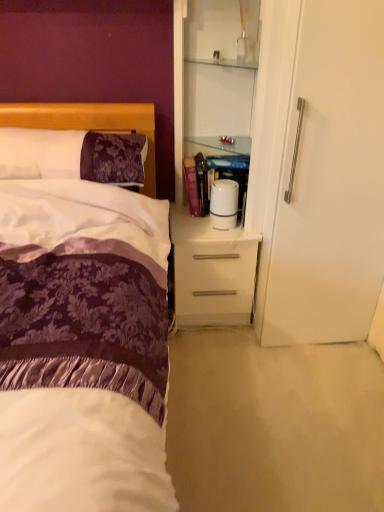
Question: Should I look upward or downward to see purple damask pillow at left?

Choices:
 (A) up
 (B) down

Answer: (A)

Question: Does purple damask pillow at left have a greater width compared to white glossy cabinet at upper right?

Choices:
 (A) yes
 (B) no

Answer: (A)

Question: From a real-world perspective, is purple damask pillow at left on white glossy cabinet at upper right?

Choices:
 (A) yes
 (B) no

Answer: (B)

Question: Is purple damask pillow at left positioned behind white glossy cabinet at upper right?

Choices:
 (A) yes
 (B) no

Answer: (A)

Question: Does purple damask pillow at left have a greater height compared to white glossy cabinet at upper right?

Choices:
 (A) no
 (B) yes

Answer: (A)

Question: From the image's perspective, is purple damask pillow at left on top of white glossy cabinet at upper right?

Choices:
 (A) no
 (B) yes

Answer: (A)

Question: Is purple damask pillow at left located outside white glossy cabinet at upper right?

Choices:
 (A) no
 (B) yes

Answer: (B)

Question: Can you confirm if white glossy nightstand at center is thinner than purple damask pillow at left?

Choices:
 (A) no
 (B) yes

Answer: (A)

Question: Is the depth of white glossy nightstand at center less than that of purple damask pillow at left?

Choices:
 (A) no
 (B) yes

Answer: (A)

Question: Would you say purple damask pillow at left is part of white glossy nightstand at center's contents?

Choices:
 (A) yes
 (B) no

Answer: (B)

Question: From the image's perspective, does white glossy nightstand at center appear higher than purple damask pillow at left?

Choices:
 (A) no
 (B) yes

Answer: (A)

Question: Does white glossy nightstand at center appear on the left side of purple damask pillow at left?

Choices:
 (A) yes
 (B) no

Answer: (B)

Question: Could you tell me if white glossy nightstand at center is facing purple damask pillow at left?

Choices:
 (A) yes
 (B) no

Answer: (B)

Question: Considering the relative positions of purple damask pillow at left and white glossy nightstand at center in the image provided, is purple damask pillow at left to the right of white glossy nightstand at center from the viewer's perspective?

Choices:
 (A) no
 (B) yes

Answer: (A)